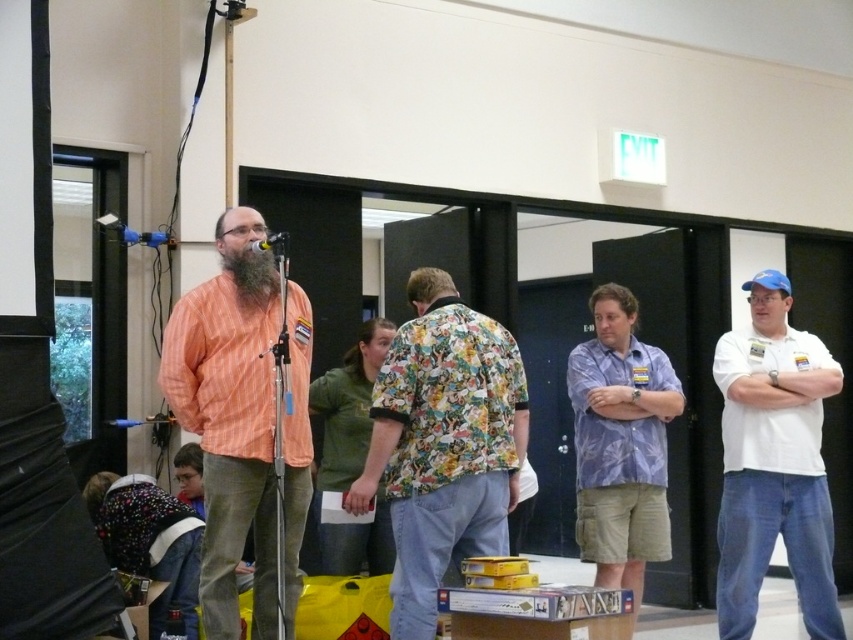
Question: Is white cotton shirt at right to the left of blue floral shirt at center from the viewer's perspective?

Choices:
 (A) yes
 (B) no

Answer: (B)

Question: Which of the following is the farthest from the observer?

Choices:
 (A) (578, 486)
 (B) (730, 636)
 (C) (271, 264)

Answer: (B)

Question: Is floral-patterned shirt at center to the left of blue floral shirt at center from the viewer's perspective?

Choices:
 (A) no
 (B) yes

Answer: (B)

Question: Which point appears farthest from the camera in this image?

Choices:
 (A) (x=236, y=436)
 (B) (x=788, y=349)
 (C) (x=270, y=289)

Answer: (B)

Question: Is white cotton shirt at right in front of beardsoft hair at center?

Choices:
 (A) no
 (B) yes

Answer: (A)

Question: Which is nearer to the beardsoft hair at center?

Choices:
 (A) matte black microphone at center
 (B) orange striped shirt at center

Answer: (A)